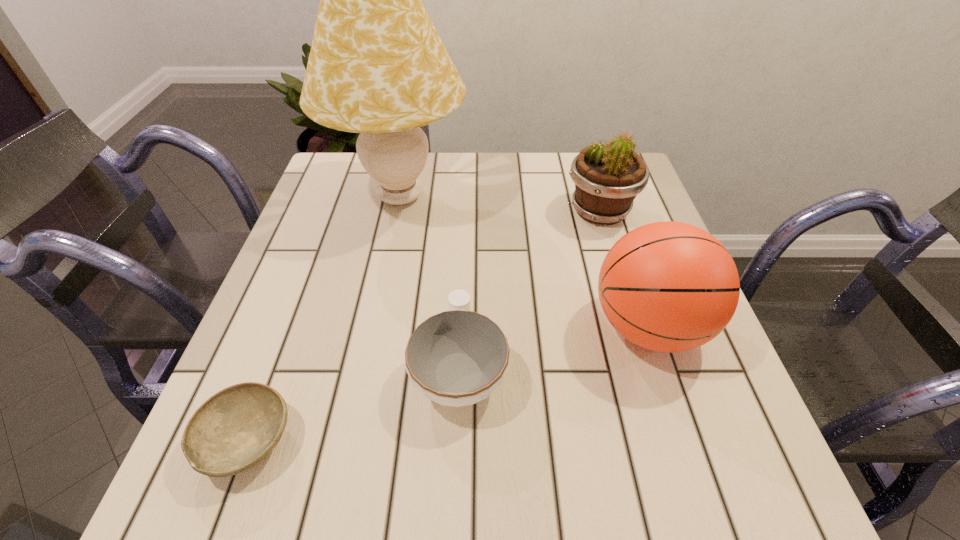
I want to click on the tallest object, so click(377, 66).

Find the location of a particular element. flowerpot is located at coordinates (607, 179).

This screenshot has height=540, width=960. I want to click on basketball, so click(x=667, y=286).

Where is `the fourth tallest object`? The image size is (960, 540). the fourth tallest object is located at coordinates point(456,358).

Where is `bowl`? bowl is located at coordinates (235, 429).

Find the location of `vacant area located 0.050m on the left of the lampshade`. vacant area located 0.050m on the left of the lampshade is located at coordinates coord(313,197).

Locate an element on the screen. This screenshot has height=540, width=960. vacant space located on the front of the flowerpot is located at coordinates (638, 338).

Where is `free space located 0.060m on the back of the basketball`? free space located 0.060m on the back of the basketball is located at coordinates (627, 264).

In order to click on vacant space situated 0.050m on the side with the handle of the second shortest object in this screenshot , I will do click(x=462, y=301).

Locate an element on the screen. The width and height of the screenshot is (960, 540). vacant space located 0.140m on the side with the handle of the second shortest object is located at coordinates (464, 270).